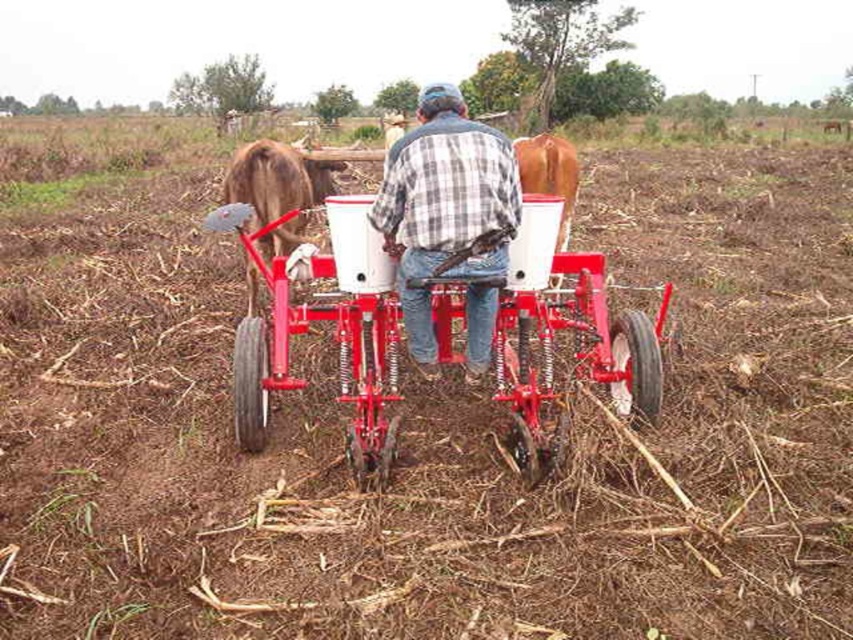
Question: Does metallic red plow at center have a lesser width compared to plaid cotton shirt at center?

Choices:
 (A) no
 (B) yes

Answer: (A)

Question: Which of these objects is positioned farthest from the brown matte bull at left?

Choices:
 (A) plaid cotton shirt at center
 (B) metallic red plow at center

Answer: (A)

Question: Considering the real-world distances, which object is closest to the brown matte bull at left?

Choices:
 (A) metallic red plow at center
 (B) plaid cotton shirt at center

Answer: (A)

Question: Considering the real-world distances, which object is farthest from the brown matte bull at left?

Choices:
 (A) plaid cotton shirt at center
 (B) metallic red plow at center

Answer: (A)

Question: Can you confirm if metallic red plow at center is positioned to the right of plaid cotton shirt at center?

Choices:
 (A) yes
 (B) no

Answer: (A)

Question: Where is metallic red plow at center located in relation to plaid cotton shirt at center in the image?

Choices:
 (A) left
 (B) right

Answer: (B)